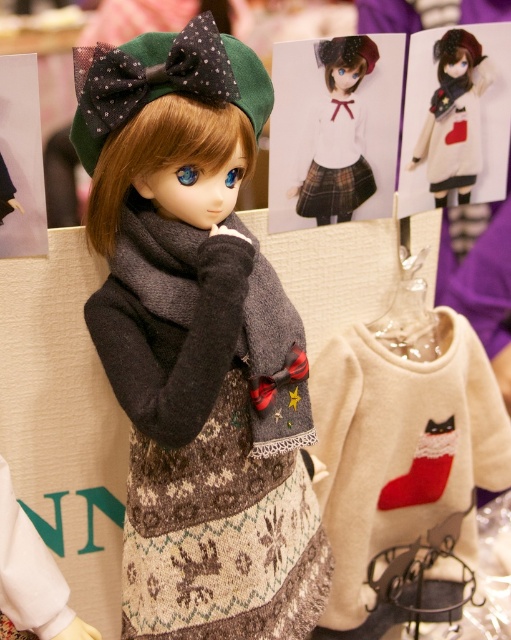
This screenshot has width=511, height=640. What do you see at coordinates (404, 476) in the screenshot? I see `creamy woolen sweater at center` at bounding box center [404, 476].

Does creamy woolen sweater at center appear on the right side of red felt stocking at lower right?

No, creamy woolen sweater at center is not to the right of red felt stocking at lower right.

Between point (358, 337) and point (453, 452), which one is positioned behind?

Positioned behind is point (453, 452).

Identify the location of creamy woolen sweater at center. The image size is (511, 640). (404, 476).

Does point (322, 164) come in front of point (396, 508)?

That is True.

Looking at this image, who is shorter, matte white sweater at center or red felt stocking at lower right?

red felt stocking at lower right is shorter.

Does point (318, 195) come in front of point (439, 436)?

That is True.

Identify the location of matte white sweater at center. (337, 134).

Which of these two, creamy woolen sweater at center or dark gray wool scarf at center, stands taller?

creamy woolen sweater at center is taller.

The image size is (511, 640). I want to click on creamy woolen sweater at center, so click(404, 476).